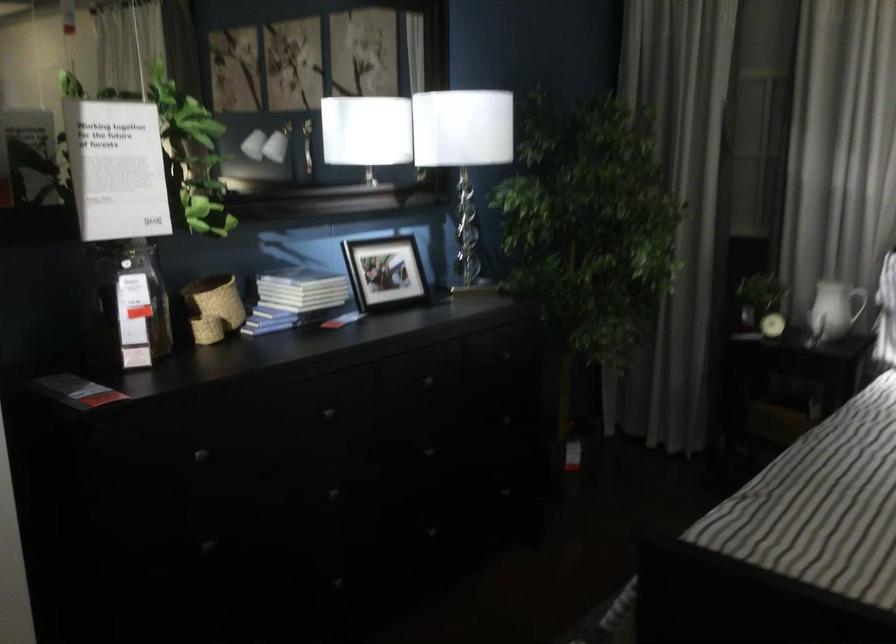
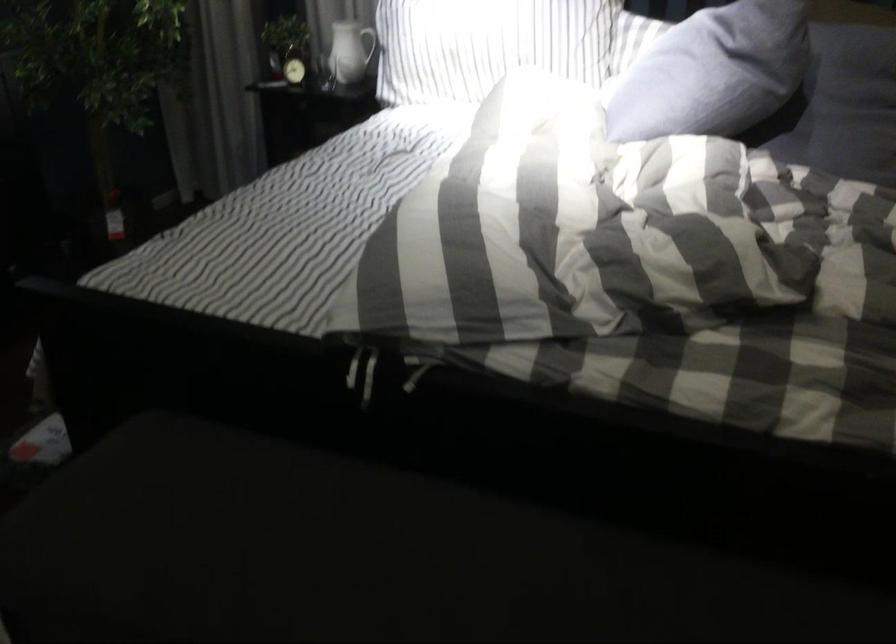
Find the pixel in the second image that matches (784,308) in the first image.

(294, 62)